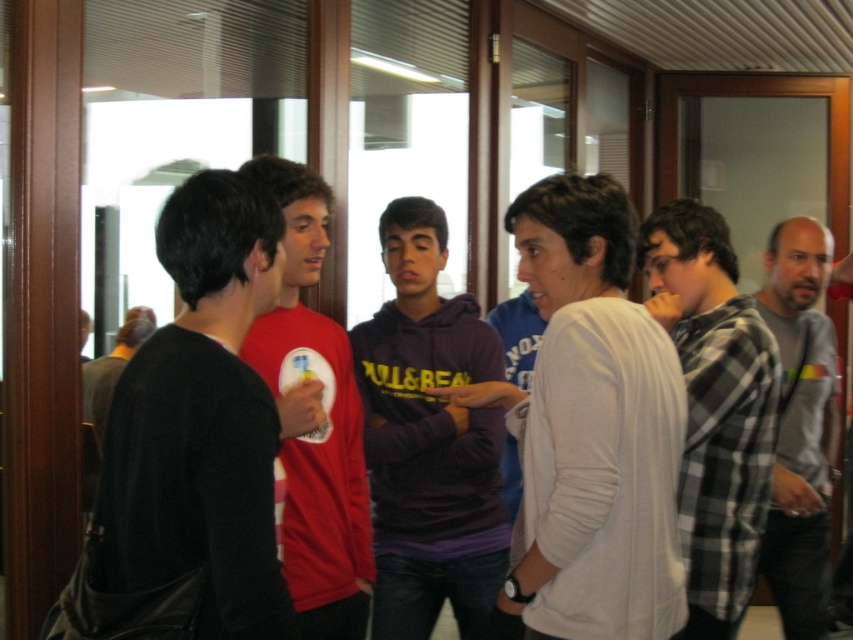
You are a fashion designer observing the group in the hallway. Which clothing item, the black leather jacket at left or the purple fleece at center, is shorter in height?

The black leather jacket at left has a lesser height compared to the purple fleece at center, so the black leather jacket at left is shorter in height.

You are a fashion designer observing the group. Which clothing item, the white cotton sweater at center or the plaid flannel shirt at right, has a shorter length?

The white cotton sweater at center is shorter than the plaid flannel shirt at right.